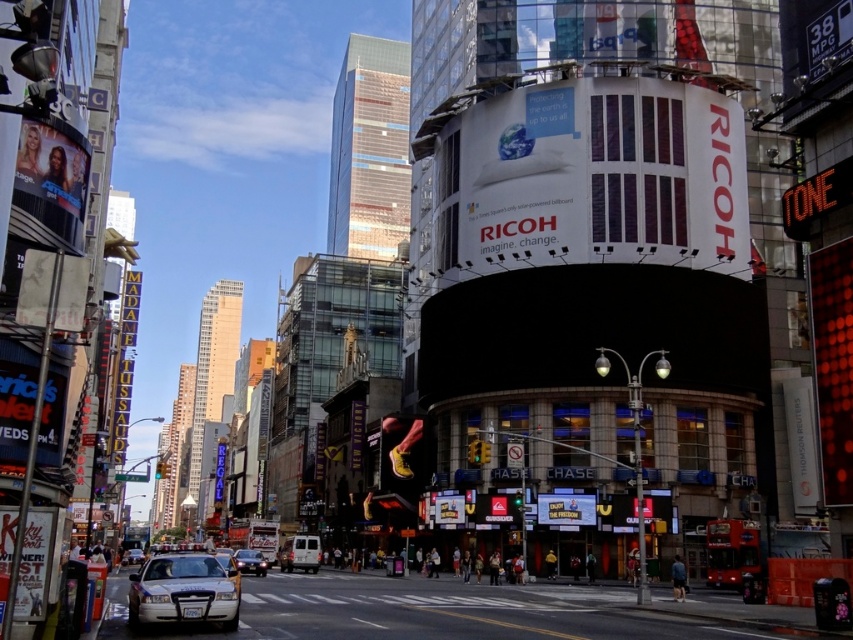
You are standing at the intersection in the image. There are two points marked on the ground in front of you. The first point is at coordinates point (x=415, y=467) and the second is at point (x=132, y=557). Which point is closer to you?

Point (x=415, y=467) is in front of point (x=132, y=557), so it is closer to you.

Where is the white glossy police car at lower left located in the scene?

The white glossy police car at lower left is located at point (183, 589).